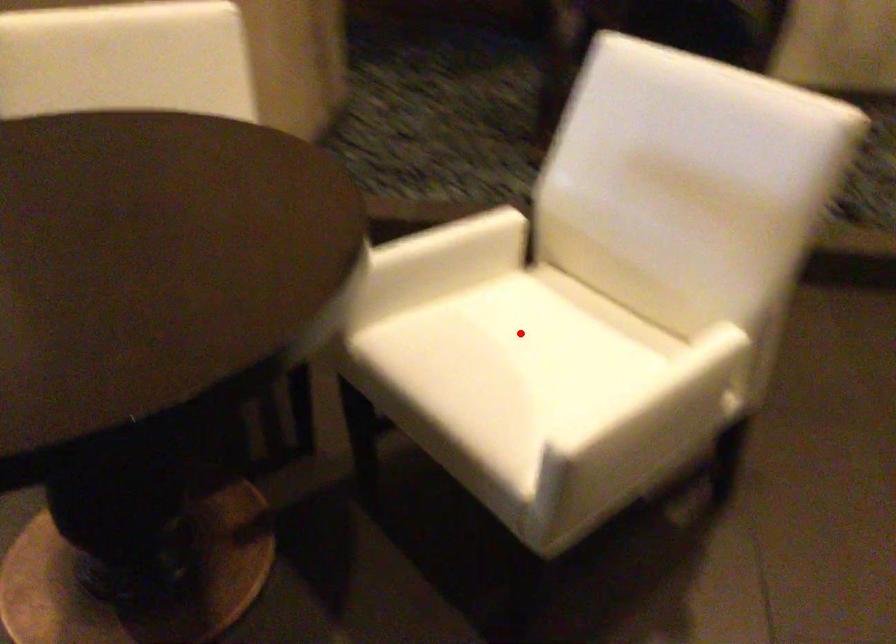
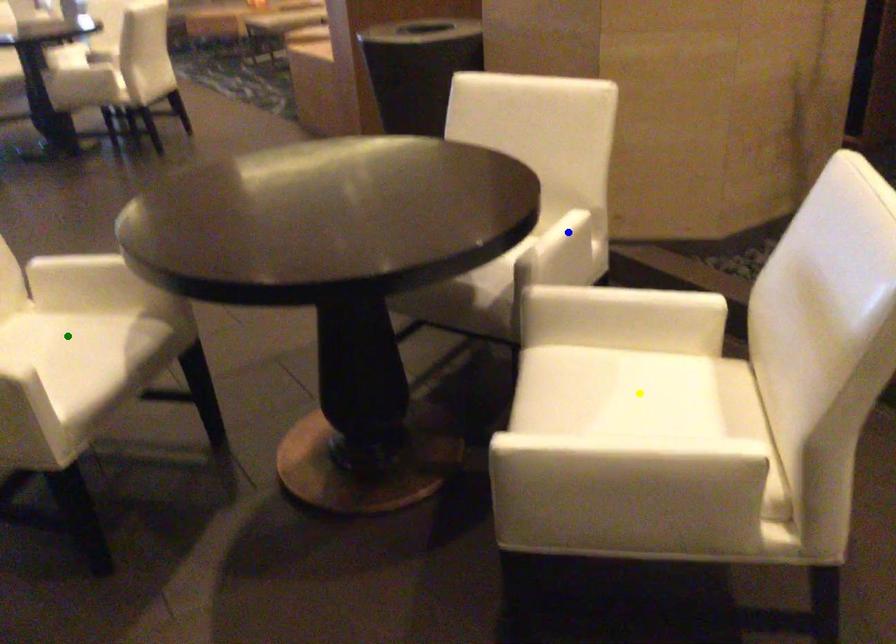
Question: I am providing you with two images of the same scene from different viewpoints. A red point is marked on the first image. You are given multiple points on the second image. Which point in image 2 is actually the same real-world point as the red point in image 1?

Choices:
 (A) yellow point
 (B) green point
 (C) blue point

Answer: (A)